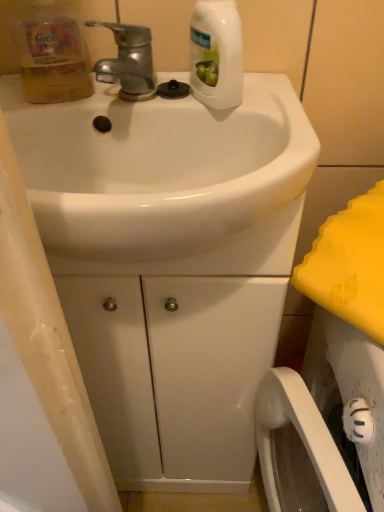
Describe the element at coordinates (128, 61) in the screenshot. I see `shiny metallic faucet at upper left` at that location.

The width and height of the screenshot is (384, 512). Describe the element at coordinates (159, 168) in the screenshot. I see `white glossy sink at center` at that location.

What do you see at coordinates (216, 54) in the screenshot?
I see `white glossy bottle at upper center, marked as the first cleaning product in a right-to-left arrangement` at bounding box center [216, 54].

This screenshot has width=384, height=512. Describe the element at coordinates (53, 59) in the screenshot. I see `translucent yellow bottle at upper left, the 1th cleaning product in the left-to-right sequence` at that location.

Where is `shiny metallic faucet at upper left`? This screenshot has width=384, height=512. shiny metallic faucet at upper left is located at coordinates (128, 61).

Which of these two, white glossy sink at center or translucent yellow bottle at upper left, the 2th cleaning product viewed from the right, stands shorter?

white glossy sink at center is shorter.

Can you tell me how much white glossy sink at center and translucent yellow bottle at upper left, the 1th cleaning product in the left-to-right sequence, differ in facing direction?

The angle between the facing direction of white glossy sink at center and the facing direction of translucent yellow bottle at upper left, the 1th cleaning product in the left-to-right sequence, is 0.00419 degrees.

Looking at this image, which object is thinner, white glossy sink at center or translucent yellow bottle at upper left, the 2th cleaning product viewed from the right?

translucent yellow bottle at upper left, the 2th cleaning product viewed from the right, is thinner.

Between white glossy sink at center and shiny metallic faucet at upper left, which one appears on the left side from the viewer's perspective?

shiny metallic faucet at upper left is more to the left.

From a real-world perspective, which object stands above the other?

shiny metallic faucet at upper left, from a real-world perspective.

This screenshot has width=384, height=512. I want to click on cleaning product that appears below the white glossy bottle at upper center, marked as the first cleaning product in a right-to-left arrangement (from a real-world perspective), so click(x=53, y=59).

Which of these two, white glossy bottle at upper center, which appears as the second cleaning product when viewed from the left, or translucent yellow bottle at upper left, the 1th cleaning product in the left-to-right sequence, is smaller?

With smaller size is translucent yellow bottle at upper left, the 1th cleaning product in the left-to-right sequence.

Does white glossy bottle at upper center, which appears as the second cleaning product when viewed from the left, have a lesser width compared to translucent yellow bottle at upper left, the 1th cleaning product in the left-to-right sequence?

No, white glossy bottle at upper center, which appears as the second cleaning product when viewed from the left, is not thinner than translucent yellow bottle at upper left, the 1th cleaning product in the left-to-right sequence.

Measure the distance from white glossy bottle at upper center, which appears as the second cleaning product when viewed from the left, to translucent yellow bottle at upper left, the 2th cleaning product viewed from the right.

A distance of 6.51 inches exists between white glossy bottle at upper center, which appears as the second cleaning product when viewed from the left, and translucent yellow bottle at upper left, the 2th cleaning product viewed from the right.

Locate an element on the screen. Image resolution: width=384 pixels, height=512 pixels. tap directly beneath the translucent yellow bottle at upper left, the 1th cleaning product in the left-to-right sequence (from a real-world perspective) is located at coordinates (128, 61).

Between point (142, 75) and point (58, 79), which one is positioned behind?

The point (58, 79) is farther.

From the image's perspective, between shiny metallic faucet at upper left and translucent yellow bottle at upper left, the 2th cleaning product viewed from the right, who is located below?

shiny metallic faucet at upper left.

From a real-world perspective, is white glossy sink at center above or below white glossy bottle at upper center, which appears as the second cleaning product when viewed from the left?

white glossy sink at center is below white glossy bottle at upper center, which appears as the second cleaning product when viewed from the left.

Which of these two, white glossy sink at center or white glossy bottle at upper center, marked as the first cleaning product in a right-to-left arrangement, is wider?

white glossy sink at center.

Is white glossy bottle at upper center, which appears as the second cleaning product when viewed from the left, at the back of white glossy sink at center?

No, white glossy sink at center is not facing the opposite direction of white glossy bottle at upper center, which appears as the second cleaning product when viewed from the left.

Does white glossy sink at center contain white glossy bottle at upper center, marked as the first cleaning product in a right-to-left arrangement?

Definitely not — white glossy bottle at upper center, marked as the first cleaning product in a right-to-left arrangement, is not inside white glossy sink at center.

From the image's perspective, between white glossy bottle at upper center, marked as the first cleaning product in a right-to-left arrangement, and white glossy sink at center, who is located below?

white glossy sink at center.

Does white glossy bottle at upper center, marked as the first cleaning product in a right-to-left arrangement, have a larger size compared to white glossy sink at center?

No, white glossy bottle at upper center, marked as the first cleaning product in a right-to-left arrangement, is not bigger than white glossy sink at center.

From a real-world perspective, which is physically above, white glossy bottle at upper center, marked as the first cleaning product in a right-to-left arrangement, or white glossy sink at center?

white glossy bottle at upper center, marked as the first cleaning product in a right-to-left arrangement, from a real-world perspective.

Which object is more forward, white glossy bottle at upper center, marked as the first cleaning product in a right-to-left arrangement, or white glossy sink at center?

Positioned in front is white glossy sink at center.

Could you tell me if translucent yellow bottle at upper left, the 2th cleaning product viewed from the right, is turned towards white glossy bottle at upper center, marked as the first cleaning product in a right-to-left arrangement?

No, translucent yellow bottle at upper left, the 2th cleaning product viewed from the right, is not aimed at white glossy bottle at upper center, marked as the first cleaning product in a right-to-left arrangement.

Is translucent yellow bottle at upper left, the 2th cleaning product viewed from the right, outside of white glossy bottle at upper center, marked as the first cleaning product in a right-to-left arrangement?

translucent yellow bottle at upper left, the 2th cleaning product viewed from the right, lies outside white glossy bottle at upper center, marked as the first cleaning product in a right-to-left arrangement,'s area.

Which of these two, translucent yellow bottle at upper left, the 1th cleaning product in the left-to-right sequence, or white glossy bottle at upper center, which appears as the second cleaning product when viewed from the left, stands shorter?

With less height is translucent yellow bottle at upper left, the 1th cleaning product in the left-to-right sequence.

Identify the location of cleaning product on the left of white glossy bottle at upper center, marked as the first cleaning product in a right-to-left arrangement. The height and width of the screenshot is (512, 384). (53, 59).

Image resolution: width=384 pixels, height=512 pixels. In order to click on cleaning product lying on the left of white glossy sink at center in this screenshot , I will do `click(53, 59)`.

The width and height of the screenshot is (384, 512). Identify the location of sink on the right side of shiny metallic faucet at upper left. (159, 168).

When comparing their distances from shiny metallic faucet at upper left, does translucent yellow bottle at upper left, the 1th cleaning product in the left-to-right sequence, or white glossy bottle at upper center, marked as the first cleaning product in a right-to-left arrangement, seem closer?

translucent yellow bottle at upper left, the 1th cleaning product in the left-to-right sequence, is positioned closer to the anchor shiny metallic faucet at upper left.

Which object lies nearer to the anchor point white glossy sink at center, shiny metallic faucet at upper left or white glossy bottle at upper center, marked as the first cleaning product in a right-to-left arrangement?

white glossy bottle at upper center, marked as the first cleaning product in a right-to-left arrangement, is positioned closer to the anchor white glossy sink at center.

Looking at the image, which one is located further to shiny metallic faucet at upper left, white glossy bottle at upper center, which appears as the second cleaning product when viewed from the left, or white glossy sink at center?

The object further to shiny metallic faucet at upper left is white glossy sink at center.

Based on their spatial positions, is white glossy bottle at upper center, which appears as the second cleaning product when viewed from the left, or translucent yellow bottle at upper left, the 1th cleaning product in the left-to-right sequence, further from white glossy sink at center?

The object further to white glossy sink at center is translucent yellow bottle at upper left, the 1th cleaning product in the left-to-right sequence.

Looking at the image, which one is located closer to white glossy bottle at upper center, which appears as the second cleaning product when viewed from the left, white glossy sink at center or shiny metallic faucet at upper left?

shiny metallic faucet at upper left lies closer to white glossy bottle at upper center, which appears as the second cleaning product when viewed from the left, than the other object.

Which object lies nearer to the anchor point translucent yellow bottle at upper left, the 1th cleaning product in the left-to-right sequence, white glossy bottle at upper center, marked as the first cleaning product in a right-to-left arrangement, or shiny metallic faucet at upper left?

Among the two, shiny metallic faucet at upper left is located nearer to translucent yellow bottle at upper left, the 1th cleaning product in the left-to-right sequence.

Based on their spatial positions, is translucent yellow bottle at upper left, the 1th cleaning product in the left-to-right sequence, or shiny metallic faucet at upper left further from white glossy bottle at upper center, which appears as the second cleaning product when viewed from the left?

Among the two, translucent yellow bottle at upper left, the 1th cleaning product in the left-to-right sequence, is located further to white glossy bottle at upper center, which appears as the second cleaning product when viewed from the left.

Which object lies further to the anchor point white glossy bottle at upper center, marked as the first cleaning product in a right-to-left arrangement, translucent yellow bottle at upper left, the 1th cleaning product in the left-to-right sequence, or white glossy sink at center?

Among the two, translucent yellow bottle at upper left, the 1th cleaning product in the left-to-right sequence, is located further to white glossy bottle at upper center, marked as the first cleaning product in a right-to-left arrangement.

This screenshot has height=512, width=384. Find the location of `tap between white glossy bottle at upper center, marked as the first cleaning product in a right-to-left arrangement, and white glossy sink at center vertically`. tap between white glossy bottle at upper center, marked as the first cleaning product in a right-to-left arrangement, and white glossy sink at center vertically is located at coordinates (128, 61).

You are a GUI agent. You are given a task and a screenshot of the screen. Output one action in this format:
    pyautogui.click(x=<x>, y=<y>)
    Task: Click on the tap between translucent yellow bottle at upper left, the 2th cleaning product viewed from the right, and white glossy sink at center, in the vertical direction
    The height and width of the screenshot is (512, 384).
    Given the screenshot: What is the action you would take?
    pyautogui.click(x=128, y=61)

Locate an element on the screen. This screenshot has width=384, height=512. sink between translucent yellow bottle at upper left, the 2th cleaning product viewed from the right, and white glossy bottle at upper center, which appears as the second cleaning product when viewed from the left, from left to right is located at coordinates (159, 168).

Find the location of a particular element. Image resolution: width=384 pixels, height=512 pixels. tap located between translucent yellow bottle at upper left, the 1th cleaning product in the left-to-right sequence, and white glossy bottle at upper center, marked as the first cleaning product in a right-to-left arrangement, in the left-right direction is located at coordinates (128, 61).